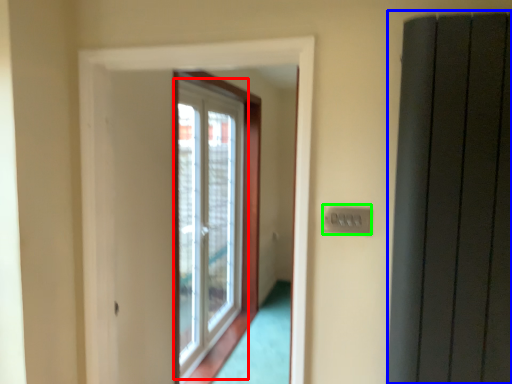
Question: Which object is the farthest from window (highlighted by a red box)? Choose among these: elevator (highlighted by a blue box) or electric outlet (highlighted by a green box).

Choices:
 (A) elevator
 (B) electric outlet

Answer: (B)